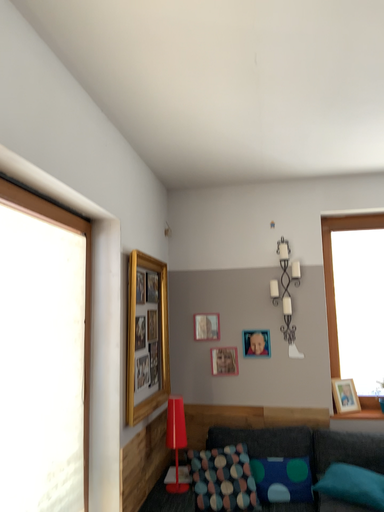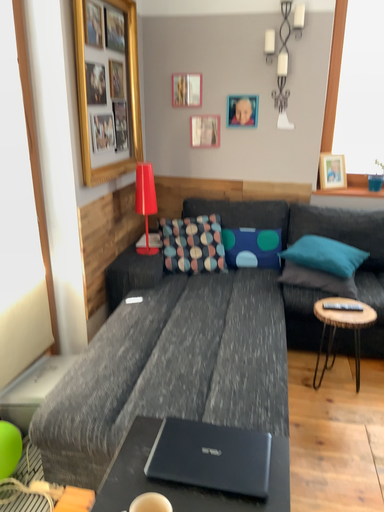
Question: Which way did the camera rotate in the video?

Choices:
 (A) rotated upward
 (B) rotated downward

Answer: (B)